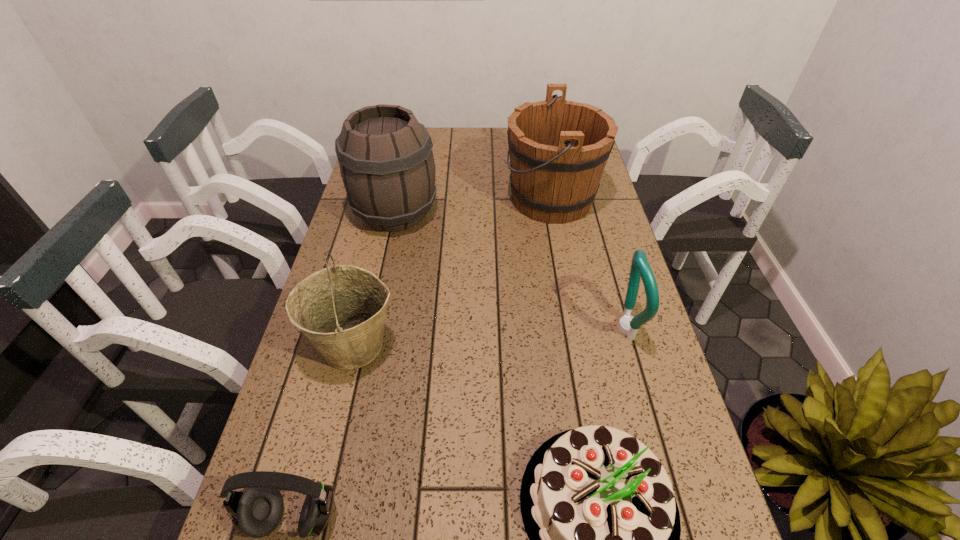
This screenshot has height=540, width=960. Identify the location of wine bucket that is positioned at the right edge. (558, 149).

Identify the location of bottle opener located at the right edge. (628, 325).

I want to click on vacant area at the far edge, so click(x=478, y=130).

Image resolution: width=960 pixels, height=540 pixels. In order to click on free region at the left edge in this screenshot , I will do `click(339, 416)`.

Identify the location of free space at the right edge. This screenshot has width=960, height=540. (586, 298).

At what (x,y) coordinates should I click in order to perform the action: click on vacant point located between the fourth tallest object and the rightmost wine bucket. Please return your answer as a coordinate pair (x, y). This screenshot has height=540, width=960. Looking at the image, I should click on (588, 264).

Identify which object is the second closest to the rightmost wine bucket. Please provide its 2D coordinates. Your answer should be formatted as a tuple, i.e. [(x, y)], where the tuple contains the x and y coordinates of a point satisfying the conditions above.

[(628, 325)]

At what (x,y) coordinates should I click in order to perform the action: click on the fifth closest object to the rightmost wine bucket. Please return your answer as a coordinate pair (x, y). Image resolution: width=960 pixels, height=540 pixels. Looking at the image, I should click on (x=256, y=511).

The height and width of the screenshot is (540, 960). In order to click on wine bucket that is the third nearest to the headset in this screenshot , I will do `click(558, 149)`.

Locate which wine bucket is the closest to the nearest wine bucket. Please provide its 2D coordinates. Your answer should be formatted as a tuple, i.e. [(x, y)], where the tuple contains the x and y coordinates of a point satisfying the conditions above.

[(385, 155)]